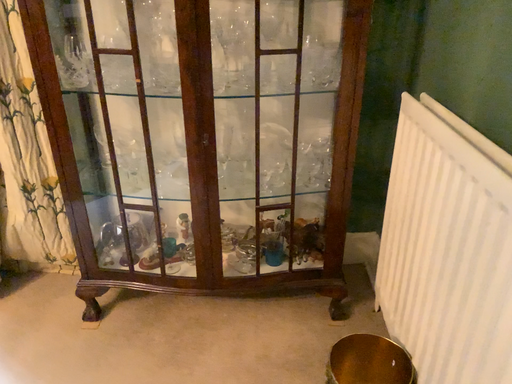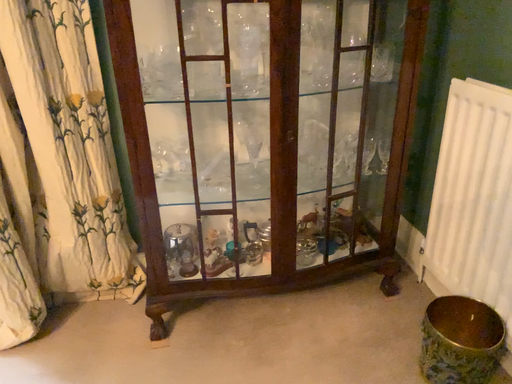
Question: Which way did the camera rotate in the video?

Choices:
 (A) rotated right
 (B) rotated left

Answer: (A)